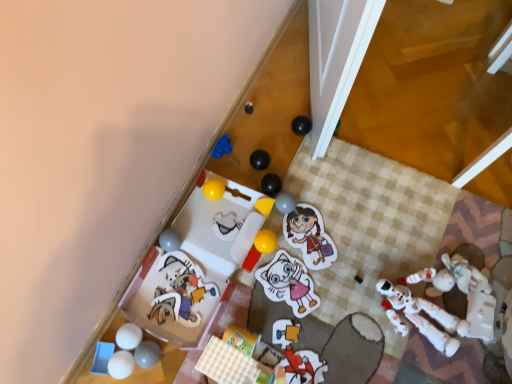
Question: From a real-world perspective, is matte gray ball at lower left, which is counted as the twelfth toy, starting from the right, physically located above or below yellow rubber ball at center, placed as the 6th toy when sorted from left to right?

Choices:
 (A) above
 (B) below

Answer: (A)

Question: In terms of height, does matte gray ball at lower left, which is counted as the twelfth toy, starting from the right, look taller or shorter compared to yellow rubber ball at center, the tenth toy when ordered from right to left?

Choices:
 (A) tall
 (B) short

Answer: (A)

Question: Estimate the real-world distances between objects in this image. Which object is closer to the matte plastic toy at center, arranged as the eighth toy when viewed from the right?

Choices:
 (A) rubber matte ball at center, marked as the third toy in a right-to-left arrangement
 (B) yellow matte block at upper center, which is the fifth toy in right-to-left order
 (C) white plastic toy at lower right, the fifteenth toy viewed from the left
 (D) black rubber ball at center, which appears as the tenth toy when viewed from the left
 (E) yellow rubber ball at center, the twelfth toy when ordered from left to right

Answer: (E)

Question: Estimate the real-world distances between objects in this image. Which object is farther from the rubber matte ball at center, marked as the third toy in a right-to-left arrangement?

Choices:
 (A) blue plastic tray at lower left, placed as the first toy when sorted from left to right
 (B) yellow matte block at upper center, placed as the 11th toy when sorted from left to right
 (C) white plastic toy at lower right, marked as the first toy in a right-to-left arrangement
 (D) cartoon cat plush at lower left, placed as the 11th toy when sorted from right to left
 (E) matte plastic toy at center, the 8th toy when ordered from left to right

Answer: (A)